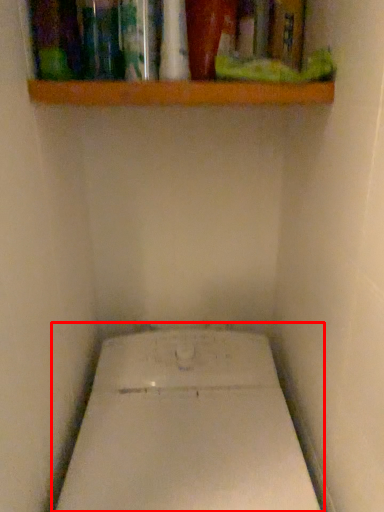
Question: Where is toilet (annotated by the red box) located in relation to shelf in the image?

Choices:
 (A) left
 (B) right

Answer: (B)